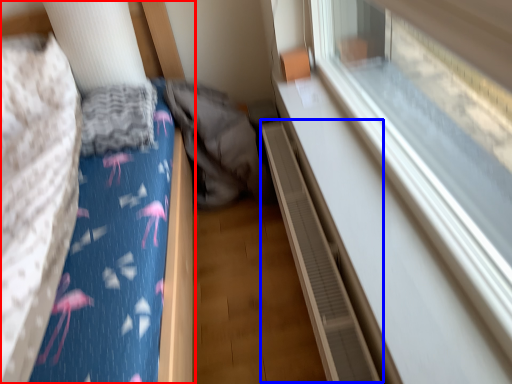
Question: Which point is further to the camera, furniture (highlighted by a red box) or balustrade (highlighted by a blue box)?

Choices:
 (A) furniture
 (B) balustrade

Answer: (B)